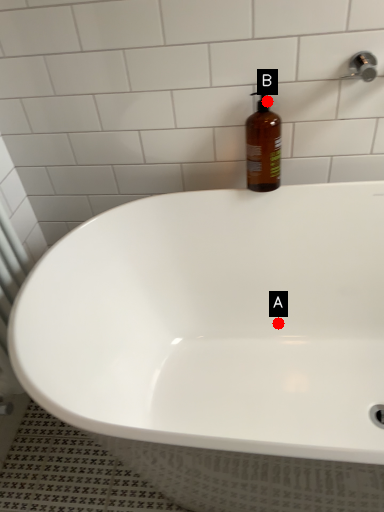
Question: Two points are circled on the image, labeled by A and B beside each circle. Which point appears farthest from the camera in this image?

Choices:
 (A) A is further
 (B) B is further

Answer: (A)